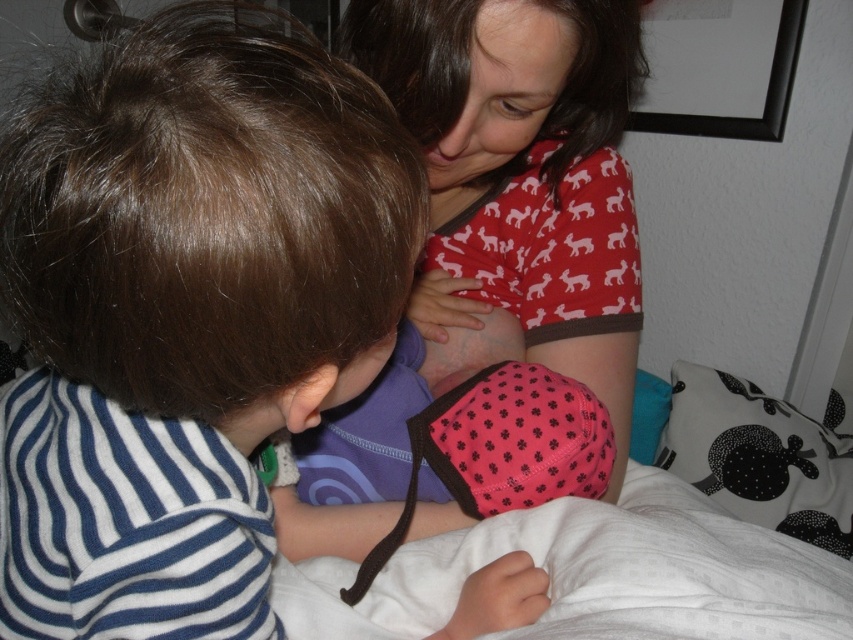
Which is more to the left, striped cotton shirt at left or teal fabric pillow at lower right?

striped cotton shirt at left

Is point (108, 416) farther from camera compared to point (641, 404)?

No, (108, 416) is closer to viewer.

Where is `striped cotton shirt at left`? Image resolution: width=853 pixels, height=640 pixels. striped cotton shirt at left is located at coordinates (186, 316).

Does striped cotton shirt at left have a greater width compared to matte red shirt at upper center?

Correct, the width of striped cotton shirt at left exceeds that of matte red shirt at upper center.

Is point (137, 152) in front of point (560, 230)?

Yes, it is.

Find the location of a particular element. Image resolution: width=853 pixels, height=640 pixels. striped cotton shirt at left is located at coordinates (186, 316).

Between matte red shirt at upper center and teal fabric pillow at lower right, which one has more height?

matte red shirt at upper center

Does point (289, 522) come behind point (653, 387)?

No.

Is point (532, 193) positioned before point (642, 428)?

Yes, point (532, 193) is in front of point (642, 428).

Find the location of `matte red shirt at upper center`. matte red shirt at upper center is located at coordinates (492, 268).